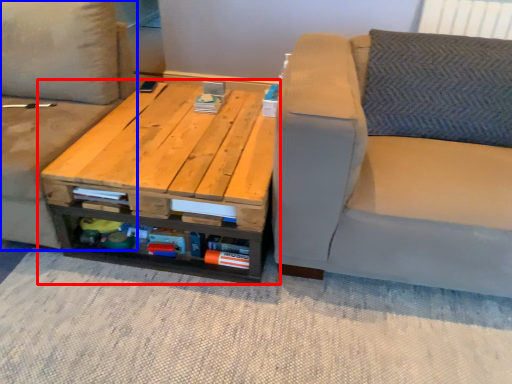
Question: Which object is closer to the camera taking this photo, table (highlighted by a red box) or studio couch (highlighted by a blue box)?

Choices:
 (A) table
 (B) studio couch

Answer: (B)